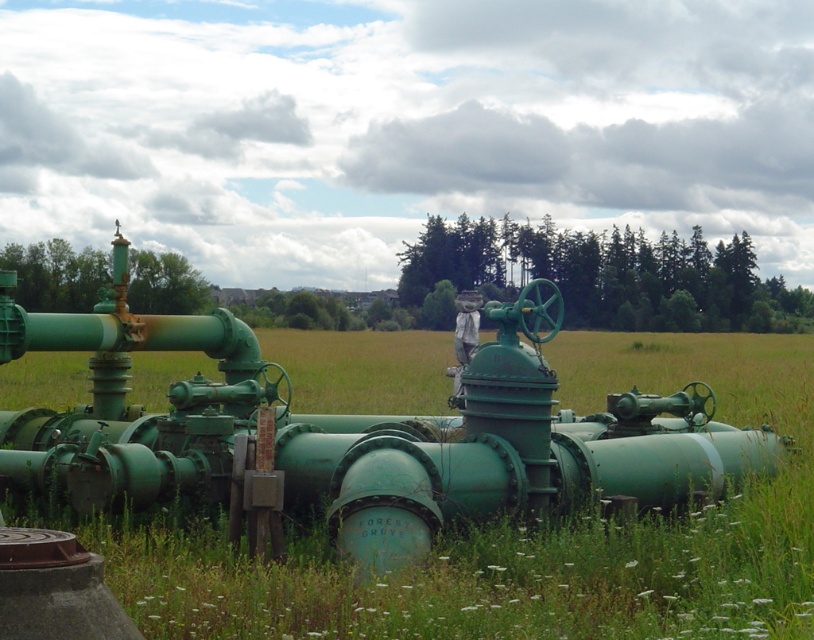
Image resolution: width=814 pixels, height=640 pixels. What do you see at coordinates (521, 536) in the screenshot?
I see `green matte pipes at center` at bounding box center [521, 536].

Is green matte pipes at center to the left of white fabric mannequin at center from the viewer's perspective?

In fact, green matte pipes at center is to the right of white fabric mannequin at center.

Which is behind, point (683, 580) or point (475, 339)?

Point (475, 339)

Identify the location of green matte pipes at center. This screenshot has width=814, height=640. (521, 536).